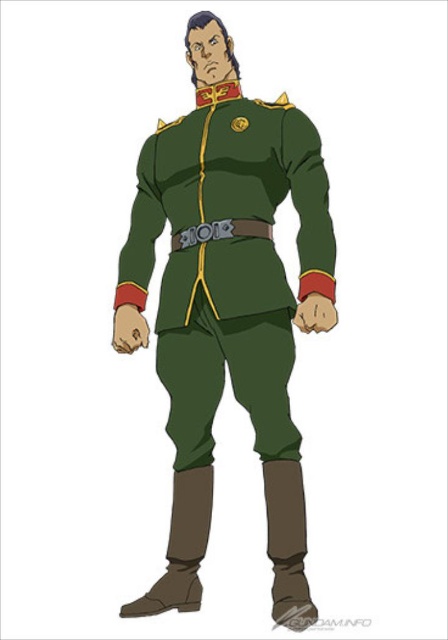
You are designing a uniform for a new character and want to ensure proper proportions. Given the green matte uniform at center and the green leather belt at center, which item has a greater width?

The green matte uniform at center has a greater width than the green leather belt at center.

You are a drone operator tasked with capturing a closeup shot of the point at coordinates (175,321). The drone can only move within a 5 feet radius from its current position. Is the point within the drone operator s 5 feet operational range?

The distance between the point at coordinates (175,321) and the camera is 7.17 feet, which exceeds the drone operator s 5 feet operational range. Therefore, the point is outside the operational range.

You are an assistant analyzing the image. The scene shows a character in a military uniform. The green matte uniform at center is located at point (228, 307). Can you confirm the exact coordinates of the green matte uniform at center?

The green matte uniform at center is located at point (228, 307).